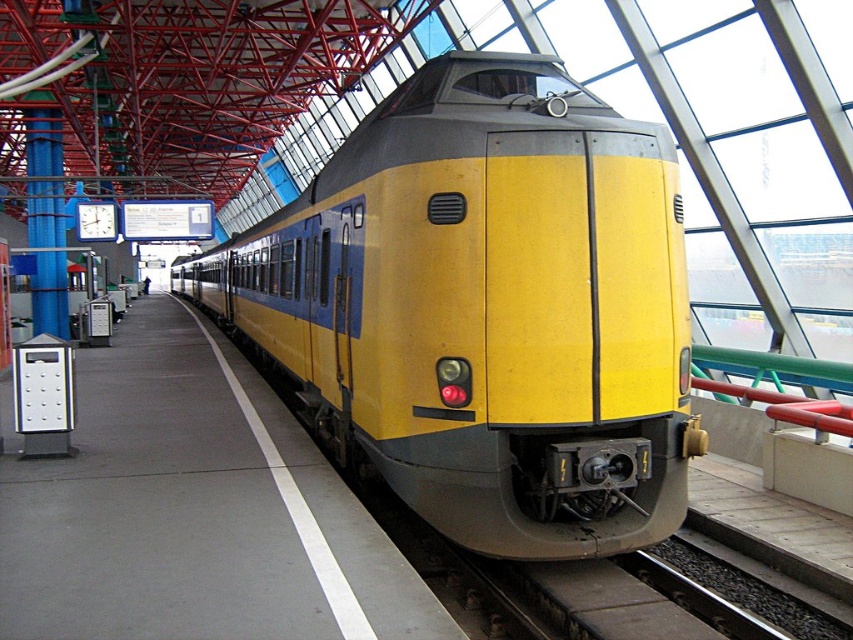
Is point (437, 246) farther from viewer compared to point (77, 541)?

Yes, point (437, 246) is behind point (77, 541).

Can you confirm if yellow matte train at center is positioned above yellow matte platform at center?

Yes, yellow matte train at center is above yellow matte platform at center.

Who is more forward, (358, 369) or (376, 554)?

Positioned in front is point (376, 554).

Locate an element on the screen. The height and width of the screenshot is (640, 853). yellow matte train at center is located at coordinates (486, 308).